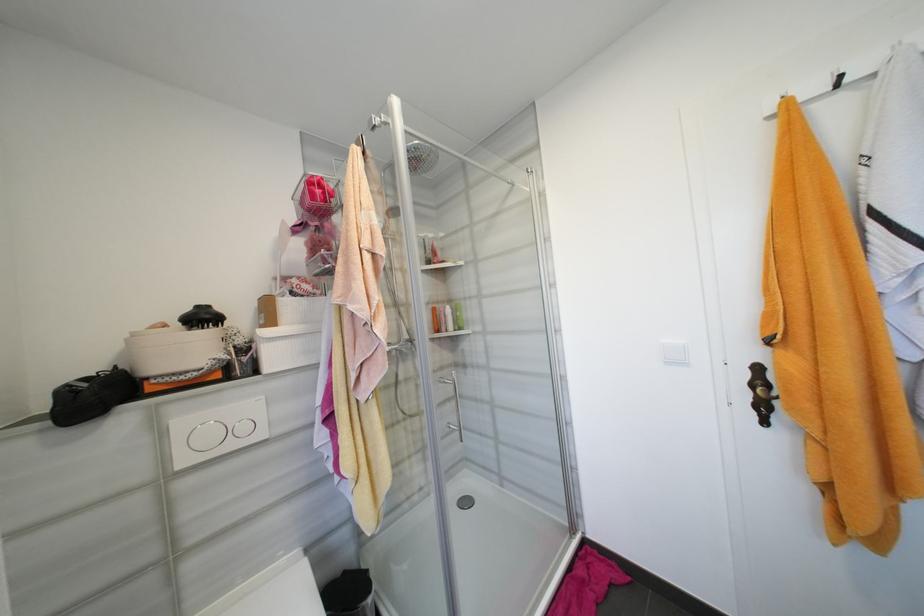
What do you see at coordinates (392, 238) in the screenshot? The image size is (924, 616). I see `a shower control lever` at bounding box center [392, 238].